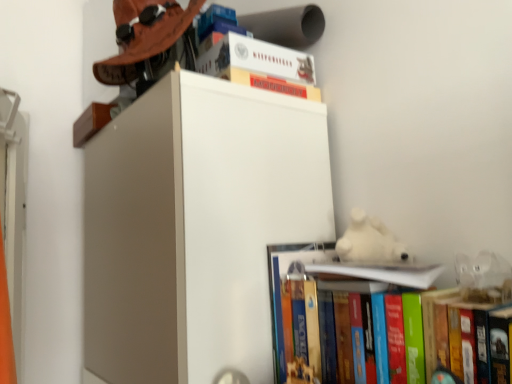
In order to click on hardcover book at upper center, the 1th book in the top-to-bottom sequence in this screenshot , I will do `click(268, 52)`.

This screenshot has height=384, width=512. I want to click on hardcover book at lower right, acting as the first book starting from the bottom, so click(379, 322).

What do you see at coordinates (379, 322) in the screenshot? The height and width of the screenshot is (384, 512). I see `hardcover book at lower right, acting as the first book starting from the bottom` at bounding box center [379, 322].

Find the location of a particular element. white paper at upper center, marked as the second book in a bottom-to-top arrangement is located at coordinates (382, 272).

Is white plush bear at upper right looking in the opposite direction of matte brown hat at upper left?

No, white plush bear at upper right is not facing away from matte brown hat at upper left.

Is matte brown hat at upper left a part of white plush bear at upper right?

Actually, matte brown hat at upper left is outside white plush bear at upper right.

Is white plush bear at upper right thinner than matte brown hat at upper left?

Correct, the width of white plush bear at upper right is less than that of matte brown hat at upper left.

From the image's perspective, is white paper at upper center, marked as the second book in a bottom-to-top arrangement, below hardcover book at upper center, arranged as the third book when ordered from the bottom?

Yes, from the image's perspective, white paper at upper center, marked as the second book in a bottom-to-top arrangement, is below hardcover book at upper center, arranged as the third book when ordered from the bottom.

Is white paper at upper center, marked as the second book in a bottom-to-top arrangement, facing away from hardcover book at upper center, arranged as the third book when ordered from the bottom?

white paper at upper center, marked as the second book in a bottom-to-top arrangement, does not have its back to hardcover book at upper center, arranged as the third book when ordered from the bottom.

There is a white paper at upper center, marked as the second book in a bottom-to-top arrangement. Identify the location of book above it (from a real-world perspective). (268, 52).

Can you confirm if white plush bear at upper right is positioned to the left of hardcover book at upper center, the 1th book in the top-to-bottom sequence?

In fact, white plush bear at upper right is to the right of hardcover book at upper center, the 1th book in the top-to-bottom sequence.

From a real-world perspective, is white plush bear at upper right physically located above or below hardcover book at upper center, the 1th book in the top-to-bottom sequence?

white plush bear at upper right is situated lower than hardcover book at upper center, the 1th book in the top-to-bottom sequence, in the real world.

Looking at this image, which object is wider, white plush bear at upper right or hardcover book at upper center, the 1th book in the top-to-bottom sequence?

Wider between the two is hardcover book at upper center, the 1th book in the top-to-bottom sequence.

Which object is further away from the camera, hardcover book at upper center, the 1th book in the top-to-bottom sequence, or white plush bear at upper right?

hardcover book at upper center, the 1th book in the top-to-bottom sequence, is behind.

Which is more to the right, hardcover book at upper center, the 1th book in the top-to-bottom sequence, or white plush bear at upper right?

From the viewer's perspective, white plush bear at upper right appears more on the right side.

Who is taller, hardcover book at upper center, arranged as the third book when ordered from the bottom, or white plush bear at upper right?

white plush bear at upper right is taller.

Is hardcover book at upper center, arranged as the third book when ordered from the bottom, looking in the opposite direction of hardcover book at lower right, which is counted as the third book, starting from the top?

No, hardcover book at upper center, arranged as the third book when ordered from the bottom, is not facing the opposite direction of hardcover book at lower right, which is counted as the third book, starting from the top.

Is hardcover book at upper center, the 1th book in the top-to-bottom sequence, located outside hardcover book at lower right, which is counted as the third book, starting from the top?

Yes.

Which book is the 2nd one when counting from the front of the hardcover book at upper center, arranged as the third book when ordered from the bottom? Please provide its 2D coordinates.

[(379, 322)]

Is hardcover book at upper center, the 1th book in the top-to-bottom sequence, bigger or smaller than hardcover book at lower right, acting as the first book starting from the bottom?

hardcover book at upper center, the 1th book in the top-to-bottom sequence, is smaller than hardcover book at lower right, acting as the first book starting from the bottom.

Is matte brown hat at upper left not close to hardcover book at upper center, arranged as the third book when ordered from the bottom?

No, matte brown hat at upper left is not far from hardcover book at upper center, arranged as the third book when ordered from the bottom.

Find the location of a particular element. The height and width of the screenshot is (384, 512). book that is the 1st one when counting downward from the matte brown hat at upper left (from the image's perspective) is located at coordinates (268, 52).

Would you say matte brown hat at upper left contains hardcover book at upper center, the 1th book in the top-to-bottom sequence?

No, hardcover book at upper center, the 1th book in the top-to-bottom sequence, is not surrounded by matte brown hat at upper left.

From the image's perspective, between hardcover book at lower right, which is counted as the third book, starting from the top, and white paper at upper center, marked as the second book in a bottom-to-top arrangement, who is located below?

hardcover book at lower right, which is counted as the third book, starting from the top.

Is hardcover book at lower right, acting as the first book starting from the bottom, to the left or to the right of white paper at upper center, marked as the second book in a bottom-to-top arrangement, in the image?

In the image, hardcover book at lower right, acting as the first book starting from the bottom, appears on the right side of white paper at upper center, marked as the second book in a bottom-to-top arrangement.

The image size is (512, 384). Identify the location of the 1st book positioned above the hardcover book at lower right, acting as the first book starting from the bottom (from the image's perspective). (382, 272).

The height and width of the screenshot is (384, 512). Identify the location of animal located underneath the matte brown hat at upper left (from a real-world perspective). (369, 241).

I want to click on the 1st book to the right of the hardcover book at upper center, arranged as the third book when ordered from the bottom, starting your count from the anchor, so click(x=382, y=272).

Looking at the image, which one is located closer to white plush bear at upper right, hardcover book at lower right, acting as the first book starting from the bottom, or matte brown hat at upper left?

Among the two, hardcover book at lower right, acting as the first book starting from the bottom, is located nearer to white plush bear at upper right.

Looking at the image, which one is located further to hardcover book at lower right, which is counted as the third book, starting from the top, white paper at upper center, acting as the second book starting from the top, or hardcover book at upper center, the 1th book in the top-to-bottom sequence?

The object further to hardcover book at lower right, which is counted as the third book, starting from the top, is hardcover book at upper center, the 1th book in the top-to-bottom sequence.

In the scene shown: Estimate the real-world distances between objects in this image. Which object is closer to hardcover book at upper center, the 1th book in the top-to-bottom sequence, hardcover book at lower right, acting as the first book starting from the bottom, or white paper at upper center, acting as the second book starting from the top?

hardcover book at lower right, acting as the first book starting from the bottom.

Estimate the real-world distances between objects in this image. Which object is closer to white paper at upper center, acting as the second book starting from the top, hardcover book at lower right, acting as the first book starting from the bottom, or hardcover book at upper center, the 1th book in the top-to-bottom sequence?

Based on the image, hardcover book at lower right, acting as the first book starting from the bottom, appears to be nearer to white paper at upper center, acting as the second book starting from the top.

Looking at this image, looking at the image, which one is located further to hardcover book at upper center, arranged as the third book when ordered from the bottom, white paper at upper center, acting as the second book starting from the top, or white plush bear at upper right?

white paper at upper center, acting as the second book starting from the top, is positioned further to the anchor hardcover book at upper center, arranged as the third book when ordered from the bottom.

Based on their spatial positions, is white paper at upper center, acting as the second book starting from the top, or hardcover book at upper center, arranged as the third book when ordered from the bottom, closer to white plush bear at upper right?

white paper at upper center, acting as the second book starting from the top.

From the image, which object appears to be nearer to white paper at upper center, acting as the second book starting from the top, matte brown hat at upper left or white plush bear at upper right?

Based on the image, white plush bear at upper right appears to be nearer to white paper at upper center, acting as the second book starting from the top.

From the image, which object appears to be nearer to white plush bear at upper right, white paper at upper center, acting as the second book starting from the top, or hardcover book at lower right, acting as the first book starting from the bottom?

The object closer to white plush bear at upper right is white paper at upper center, acting as the second book starting from the top.

This screenshot has width=512, height=384. In order to click on book between hardcover book at upper center, the 1th book in the top-to-bottom sequence, and hardcover book at lower right, which is counted as the third book, starting from the top, from top to bottom in this screenshot , I will do `click(382, 272)`.

You are a GUI agent. You are given a task and a screenshot of the screen. Output one action in this format:
    pyautogui.click(x=<x>, y=<y>)
    Task: Click on the book between matte brown hat at upper left and white plush bear at upper right in the up-down direction
    Image resolution: width=512 pixels, height=384 pixels.
    Given the screenshot: What is the action you would take?
    pyautogui.click(x=268, y=52)

Locate an element on the screen. book positioned between hardcover book at lower right, acting as the first book starting from the bottom, and white plush bear at upper right from near to far is located at coordinates (382, 272).

Find the location of a particular element. Image resolution: width=512 pixels, height=384 pixels. animal between matte brown hat at upper left and hardcover book at lower right, acting as the first book starting from the bottom, from top to bottom is located at coordinates (369, 241).